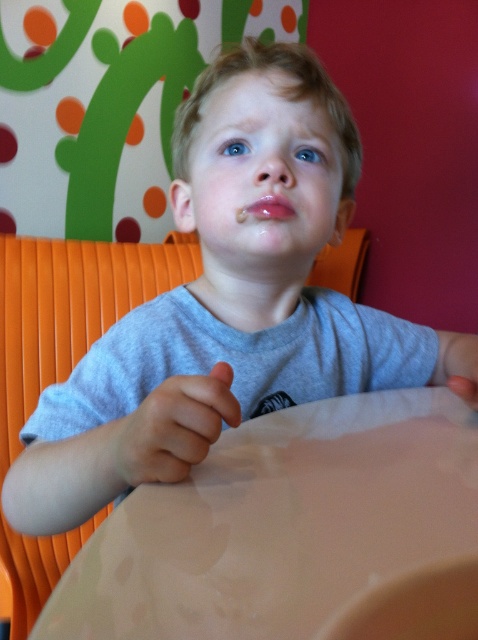
Does point (455, 346) come farther from viewer compared to point (272, 211)?

Yes, point (455, 346) is behind point (272, 211).

The image size is (478, 640). What are the coordinates of `smooth skin hand at lower center` in the screenshot? It's located at (457, 364).

Does point (460, 333) lie in front of point (252, 202)?

No, (460, 333) is behind (252, 202).

Where is `smooth skin hand at lower center`? This screenshot has height=640, width=478. smooth skin hand at lower center is located at coordinates (457, 364).

From the picture: Which is more to the right, smooth skin hand at center or glossy pink lips at center?

Positioned to the right is glossy pink lips at center.

Can you confirm if smooth skin hand at center is thinner than glossy pink lips at center?

No, smooth skin hand at center is not thinner than glossy pink lips at center.

I want to click on smooth skin hand at center, so click(169, 429).

You are a GUI agent. You are given a task and a screenshot of the screen. Output one action in this format:
    pyautogui.click(x=<x>, y=<y>)
    Task: Click on the smooth skin hand at center
    This screenshot has height=640, width=478.
    Given the screenshot: What is the action you would take?
    point(169,429)

Does orange plastic chair at center have a larger size compared to smooth skin hand at center?

Yes, orange plastic chair at center is bigger than smooth skin hand at center.

Is orange plastic chair at center wider than smooth skin hand at center?

Yes.

This screenshot has width=478, height=640. What do you see at coordinates (68, 308) in the screenshot?
I see `orange plastic chair at center` at bounding box center [68, 308].

Where is `orange plastic chair at center`? The height and width of the screenshot is (640, 478). orange plastic chair at center is located at coordinates (68, 308).